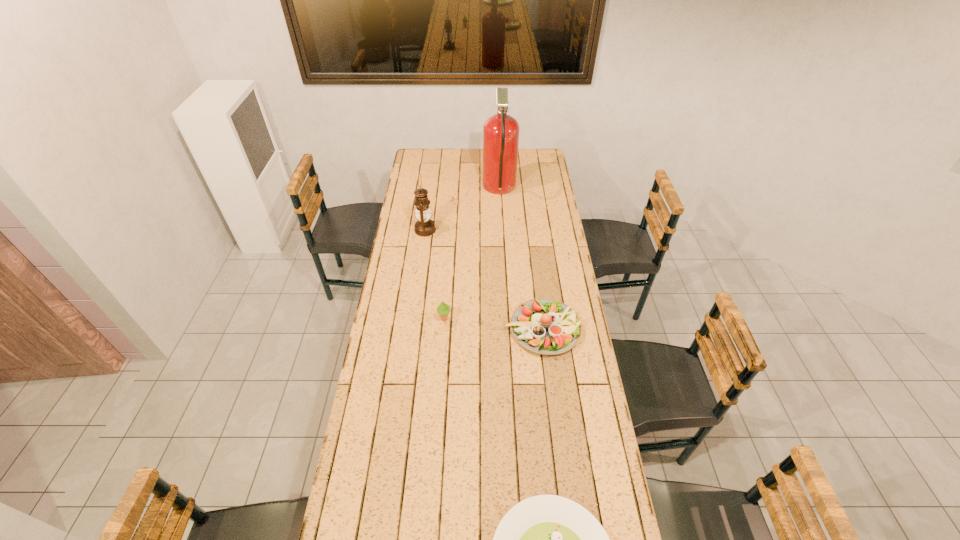
You are a GUI agent. You are given a task and a screenshot of the screen. Output one action in this format:
    pyautogui.click(x=<x>, y=<y>)
    Task: Click on the free space located with the handle and nozzle on the farthest object
    Image resolution: width=960 pixels, height=540 pixels.
    Given the screenshot: What is the action you would take?
    pyautogui.click(x=459, y=190)

This screenshot has width=960, height=540. What are the coordinates of `vacant space located 0.310m on the front of the fourth shortest object` in the screenshot? It's located at (418, 286).

Where is `vacant space located on the left of the icecream`? vacant space located on the left of the icecream is located at coordinates (420, 319).

Locate an element on the screen. vacant space located 0.230m on the back of the farther salad plate is located at coordinates click(535, 264).

You are a GUI agent. You are given a task and a screenshot of the screen. Output one action in this format:
    pyautogui.click(x=<x>, y=<y>)
    Task: Click on the object that is at the left edge
    This screenshot has height=540, width=960.
    Given the screenshot: What is the action you would take?
    pyautogui.click(x=424, y=227)

The image size is (960, 540). What are the coordinates of `object present at the right edge` in the screenshot? It's located at pyautogui.click(x=544, y=326).

Find the location of a particular element. The image size is (960, 540). vacant region at the left edge of the desktop is located at coordinates (418, 176).

The height and width of the screenshot is (540, 960). In order to click on vacant space at the right edge of the desktop in this screenshot , I will do `click(577, 420)`.

This screenshot has width=960, height=540. I want to click on vacant space at the far left corner of the desktop, so click(419, 161).

Image resolution: width=960 pixels, height=540 pixels. What are the coordinates of `unoccupied position between the oil lamp and the farthest object` in the screenshot? It's located at (463, 210).